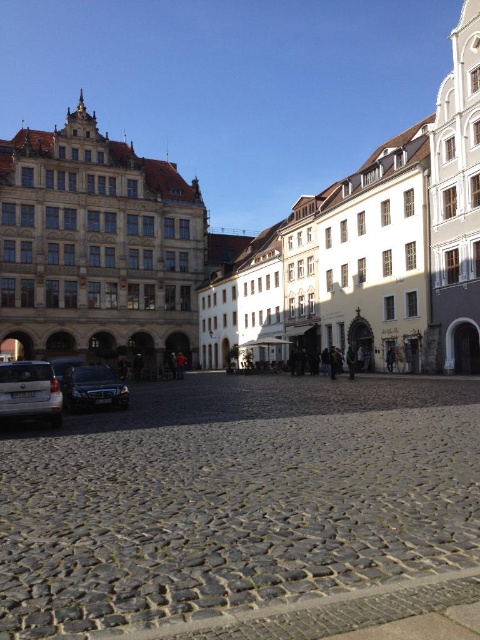
Question: Estimate the real-world distances between objects in this image. Which object is farther from the gray cobblestone at center?

Choices:
 (A) shiny silver car at lower left
 (B) silver metallic van at lower left

Answer: (A)

Question: Is the position of gray cobblestone at center more distant than that of silver metallic van at lower left?

Choices:
 (A) no
 (B) yes

Answer: (A)

Question: Which of the following is the closest to the observer?

Choices:
 (A) (68, 406)
 (B) (157, 580)

Answer: (B)

Question: Is gray cobblestone at center wider than silver metallic van at lower left?

Choices:
 (A) no
 (B) yes

Answer: (B)

Question: Does gray cobblestone at center come behind silver metallic van at lower left?

Choices:
 (A) no
 (B) yes

Answer: (A)

Question: Which object is the farthest from the shiny silver car at lower left?

Choices:
 (A) gray cobblestone at center
 (B) silver metallic van at lower left

Answer: (A)